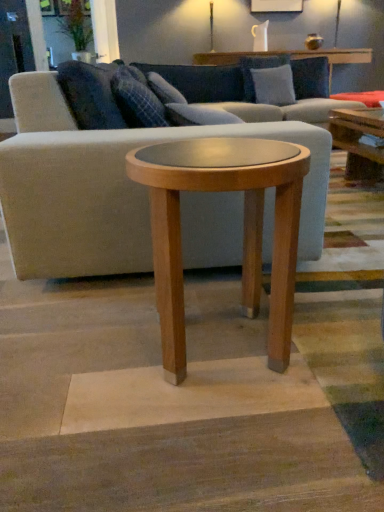
In order to face plaid fabric pillow at center, marked as the third pillow in a top-to-bottom arrangement, should I rotate leftwards or rightwards?

Turn left by 5.897 degrees to look at plaid fabric pillow at center, marked as the third pillow in a top-to-bottom arrangement.

Describe the element at coordinates (125, 177) in the screenshot. I see `light gray fabric couch at center` at that location.

You are a GUI agent. You are given a task and a screenshot of the screen. Output one action in this format:
    pyautogui.click(x=<x>, y=<y>)
    Task: Click on the blue fabric pillow at upper right, the first pillow from the top
    
    Given the screenshot: What is the action you would take?
    pyautogui.click(x=310, y=77)

Could you measure the distance between light gray fabric couch at center and blue fabric pillow at upper right, the first pillow from the back?

light gray fabric couch at center is 2.73 meters away from blue fabric pillow at upper right, the first pillow from the back.

Which of these two, light gray fabric couch at center or blue fabric pillow at upper right, the first pillow from the back, is smaller?

Smaller between the two is blue fabric pillow at upper right, the first pillow from the back.

Based on the photo, is light gray fabric couch at center looking in the opposite direction of blue fabric pillow at upper right, the first pillow from the top?

No.

Considering the relative positions of light gray fabric couch at center and blue fabric pillow at upper right, the third pillow when ordered from front to back, in the image provided, is light gray fabric couch at center to the left or to the right of blue fabric pillow at upper right, the third pillow when ordered from front to back,?

light gray fabric couch at center is to the left of blue fabric pillow at upper right, the third pillow when ordered from front to back.

Is light brown wood side table at center with plaid fabric pillow at center, which appears as the third pillow when viewed from the right?

light brown wood side table at center is not next to plaid fabric pillow at center, which appears as the third pillow when viewed from the right, and they're not touching.

Which point is more forward, (164,156) or (130,72)?

Point (164,156)

Which object is closer to the camera, light brown wood side table at center or plaid fabric pillow at center, which is the 3th pillow from back to front?

light brown wood side table at center is more forward.

How different are the orientations of light brown wood side table at center and plaid fabric pillow at center, which is the 3th pillow from back to front, in degrees?

light brown wood side table at center and plaid fabric pillow at center, which is the 3th pillow from back to front, are facing 1.09 degrees away from each other.

What's the angular difference between gray fabric pillow at upper center, placed as the 2th pillow when sorted from bottom to top, and light brown wood side table at center's facing directions?

gray fabric pillow at upper center, placed as the 2th pillow when sorted from bottom to top, and light brown wood side table at center are facing 79.5 degrees away from each other.

How distant is gray fabric pillow at upper center, the 2th pillow when ordered from front to back, from light brown wood side table at center?

A distance of 9.81 feet exists between gray fabric pillow at upper center, the 2th pillow when ordered from front to back, and light brown wood side table at center.

You are a GUI agent. You are given a task and a screenshot of the screen. Output one action in this format:
    pyautogui.click(x=<x>, y=<y>)
    Task: Click on the coffee table on the left of gray fabric pillow at upper center, which appears as the 2th pillow when viewed from the back
    Image resolution: width=384 pixels, height=512 pixels.
    Given the screenshot: What is the action you would take?
    pyautogui.click(x=244, y=228)

Does gray fabric pillow at upper center, the 2th pillow when ordered from front to back, have a greater height compared to light brown wood side table at center?

No, gray fabric pillow at upper center, the 2th pillow when ordered from front to back, is not taller than light brown wood side table at center.

In the scene shown: Based on their sizes in the image, would you say plaid fabric pillow at center, marked as the third pillow in a top-to-bottom arrangement, is bigger or smaller than blue fabric pillow at upper right, the third pillow when ordered from front to back?

In the image, plaid fabric pillow at center, marked as the third pillow in a top-to-bottom arrangement, appears to be larger than blue fabric pillow at upper right, the third pillow when ordered from front to back.

This screenshot has height=512, width=384. There is a blue fabric pillow at upper right, which is the third pillow from bottom to top. What are the coordinates of `the 1st pillow below it (from a real-world perspective)` in the screenshot? It's located at (137, 99).

Which of these two, plaid fabric pillow at center, which appears as the third pillow when viewed from the right, or blue fabric pillow at upper right, the first pillow from the back, is wider?

Wider between the two is plaid fabric pillow at center, which appears as the third pillow when viewed from the right.

From the picture: Is blue fabric pillow at upper right, the third pillow when ordered from front to back, a part of plaid fabric pillow at center, which is the 1th pillow in front-to-back order?

No, plaid fabric pillow at center, which is the 1th pillow in front-to-back order, does not contain blue fabric pillow at upper right, the third pillow when ordered from front to back.

Locate an element on the screen. The image size is (384, 512). coffee table that is below the blue fabric pillow at upper right, which is the third pillow from bottom to top (from the image's perspective) is located at coordinates (244, 228).

Does blue fabric pillow at upper right, the 3th pillow when ordered from left to right, have a lesser width compared to light brown wood side table at center?

Indeed, blue fabric pillow at upper right, the 3th pillow when ordered from left to right, has a lesser width compared to light brown wood side table at center.

From the image's perspective, is blue fabric pillow at upper right, the third pillow when ordered from front to back, under light brown wood side table at center?

No, from the image's perspective, blue fabric pillow at upper right, the third pillow when ordered from front to back, is not below light brown wood side table at center.

Consider the image. Measure the distance from blue fabric pillow at upper right, the first pillow from the back, to light brown wood side table at center.

blue fabric pillow at upper right, the first pillow from the back, is 3.38 meters from light brown wood side table at center.

Is point (260, 94) in front of point (315, 225)?

No.

Does gray fabric pillow at upper center, which appears as the 2th pillow when viewed from the back, come behind light gray fabric couch at center?

Yes, the depth of gray fabric pillow at upper center, which appears as the 2th pillow when viewed from the back, is greater than that of light gray fabric couch at center.

Considering the relative sizes of gray fabric pillow at upper center, the second pillow viewed from the top, and light gray fabric couch at center in the image provided, is gray fabric pillow at upper center, the second pillow viewed from the top, wider than light gray fabric couch at center?

In fact, gray fabric pillow at upper center, the second pillow viewed from the top, might be narrower than light gray fabric couch at center.

Between blue fabric pillow at upper right, the first pillow from the top, and light gray fabric couch at center, which one has smaller size?

With smaller size is blue fabric pillow at upper right, the first pillow from the top.

Is light gray fabric couch at center at the back of blue fabric pillow at upper right, which is the first pillow from right to left?

Yes.

Which pillow is the 3rd one when counting from the back of the light gray fabric couch at center? Please provide its 2D coordinates.

[(310, 77)]

Considering the positions of point (308, 79) and point (264, 225), is point (308, 79) closer or farther from the camera than point (264, 225)?

Point (308, 79) appears to be farther away from the viewer than point (264, 225).

From the light gray fabric couch at center, count 2nd pillow to the right and point to it. Please provide its 2D coordinates.

[(310, 77)]

This screenshot has width=384, height=512. I want to click on the 1st pillow behind the light brown wood side table at center, starting your count from the anchor, so click(x=137, y=99).

Looking at the image, which one is located closer to plaid fabric pillow at center, which is the 3th pillow from back to front, gray fabric pillow at upper center, marked as the 2th pillow in a left-to-right arrangement, or light brown wood side table at center?

light brown wood side table at center.

Based on their spatial positions, is gray fabric pillow at upper center, which appears as the 2th pillow when viewed from the right, or light gray fabric couch at center further from plaid fabric pillow at center, which is the 3th pillow from back to front?

Among the two, gray fabric pillow at upper center, which appears as the 2th pillow when viewed from the right, is located further to plaid fabric pillow at center, which is the 3th pillow from back to front.

Based on their spatial positions, is plaid fabric pillow at center, the 1th pillow viewed from the left, or light gray fabric couch at center further from gray fabric pillow at upper center, the second pillow viewed from the top?

light gray fabric couch at center is positioned further to the anchor gray fabric pillow at upper center, the second pillow viewed from the top.

Considering their positions, is blue fabric pillow at upper right, the first pillow from the back, positioned further to plaid fabric pillow at center, which is the 1th pillow in bottom-to-top order, than light gray fabric couch at center?

blue fabric pillow at upper right, the first pillow from the back.

Based on their spatial positions, is light brown wood side table at center or plaid fabric pillow at center, which is the 1th pillow in bottom-to-top order, closer to blue fabric pillow at upper right, the third pillow when ordered from front to back?

plaid fabric pillow at center, which is the 1th pillow in bottom-to-top order, lies closer to blue fabric pillow at upper right, the third pillow when ordered from front to back, than the other object.

Which object lies nearer to the anchor point light gray fabric couch at center, blue fabric pillow at upper right, the first pillow from the back, or gray fabric pillow at upper center, which appears as the 2th pillow when viewed from the right?

gray fabric pillow at upper center, which appears as the 2th pillow when viewed from the right, is positioned closer to the anchor light gray fabric couch at center.

From the picture: When comparing their distances from light brown wood side table at center, does plaid fabric pillow at center, which is the 3th pillow from back to front, or gray fabric pillow at upper center, marked as the 2th pillow in a left-to-right arrangement, seem further?

gray fabric pillow at upper center, marked as the 2th pillow in a left-to-right arrangement, is further to light brown wood side table at center.

Considering their positions, is light gray fabric couch at center positioned further to blue fabric pillow at upper right, which is the third pillow from bottom to top, than light brown wood side table at center?

The object further to blue fabric pillow at upper right, which is the third pillow from bottom to top, is light brown wood side table at center.

At what (x,y) coordinates should I click in order to perform the action: click on pillow between plaid fabric pillow at center, the 1th pillow viewed from the left, and blue fabric pillow at upper right, which is the third pillow from bottom to top, along the z-axis. Please return your answer as a coordinate pair (x, y). Looking at the image, I should click on (273, 85).

Where is `pillow between light brown wood side table at center and gray fabric pillow at upper center, the second pillow viewed from the top, from front to back`? The width and height of the screenshot is (384, 512). pillow between light brown wood side table at center and gray fabric pillow at upper center, the second pillow viewed from the top, from front to back is located at coordinates (137, 99).

Where is `pillow between light gray fabric couch at center and gray fabric pillow at upper center, which appears as the 2th pillow when viewed from the right, along the z-axis`? pillow between light gray fabric couch at center and gray fabric pillow at upper center, which appears as the 2th pillow when viewed from the right, along the z-axis is located at coordinates (137, 99).

Identify the location of studio couch between light brown wood side table at center and blue fabric pillow at upper right, the first pillow from the back, from front to back. (125, 177).